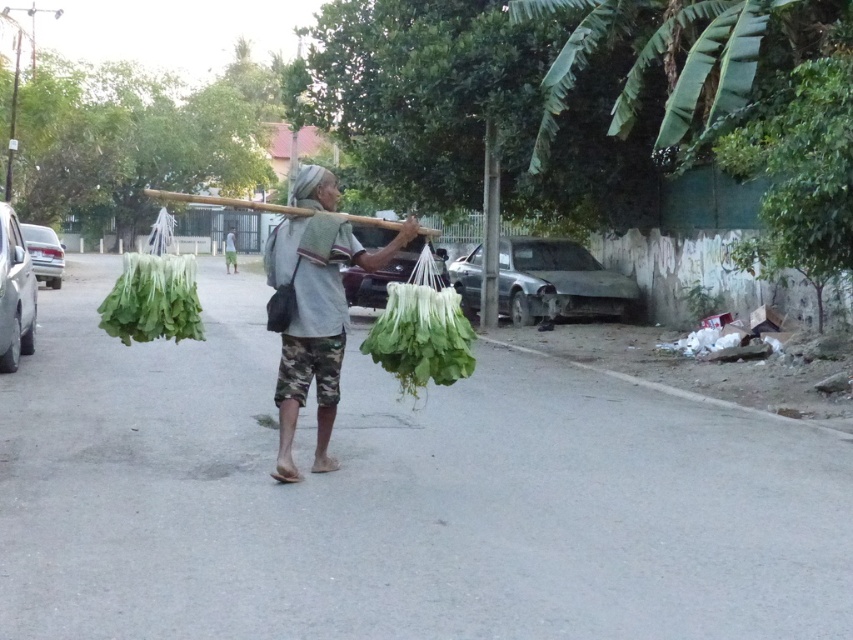
Can you confirm if green leafy at center is bigger than gray fabric headscarf at center?

Actually, green leafy at center might be smaller than gray fabric headscarf at center.

Between green leafy at center and gray fabric headscarf at center, which one has less height?

green leafy at center is shorter.

Between point (383, 317) and point (292, 196), which one is positioned behind?

The point (292, 196) is more distant.

You are a GUI agent. You are given a task and a screenshot of the screen. Output one action in this format:
    pyautogui.click(x=<x>, y=<y>)
    Task: Click on the green leafy at center
    This screenshot has height=640, width=853.
    Given the screenshot: What is the action you would take?
    point(421,332)

Can you confirm if green leafy vegetables at center is thinner than gray fabric headscarf at center?

Yes, green leafy vegetables at center is thinner than gray fabric headscarf at center.

Is point (299, 321) closer to camera compared to point (300, 204)?

Yes, it is.

Who is more distant from viewer, [293,378] or [303,189]?

The point [303,189] is more distant.

Image resolution: width=853 pixels, height=640 pixels. I want to click on green leafy vegetables at center, so click(x=315, y=321).

From the picture: Does green leafy vegetables at center appear over green leafy at center?

Correct, green leafy vegetables at center is located above green leafy at center.

Does green leafy vegetables at center have a greater height compared to green leafy at center?

Yes, green leafy vegetables at center is taller than green leafy at center.

Is point (323, 449) positioned before point (415, 378)?

No, it is behind (415, 378).

This screenshot has height=640, width=853. Find the location of `green leafy vegetables at center`. green leafy vegetables at center is located at coordinates (315, 321).